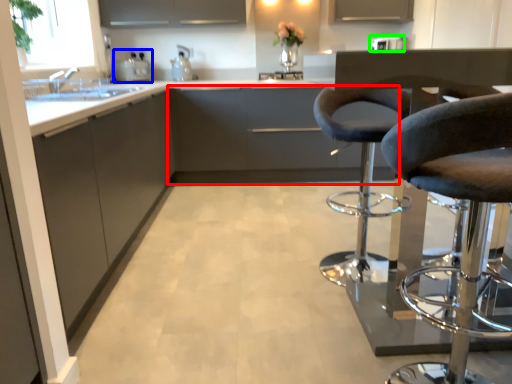
Question: Based on their relative distances, which object is farther from cabinetry (highlighted by a red box)? Choose from appliance (highlighted by a blue box) and appliance (highlighted by a green box).

Choices:
 (A) appliance
 (B) appliance

Answer: (B)